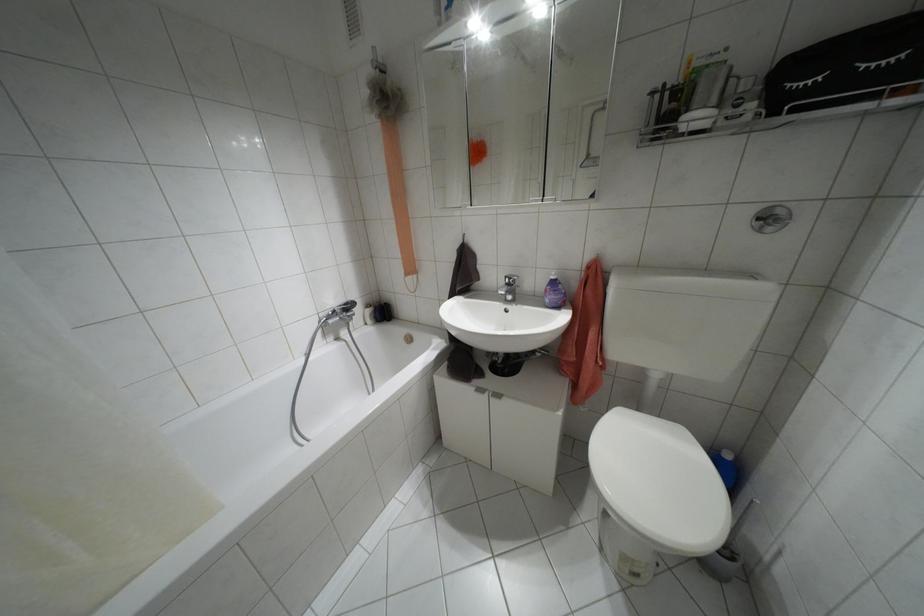
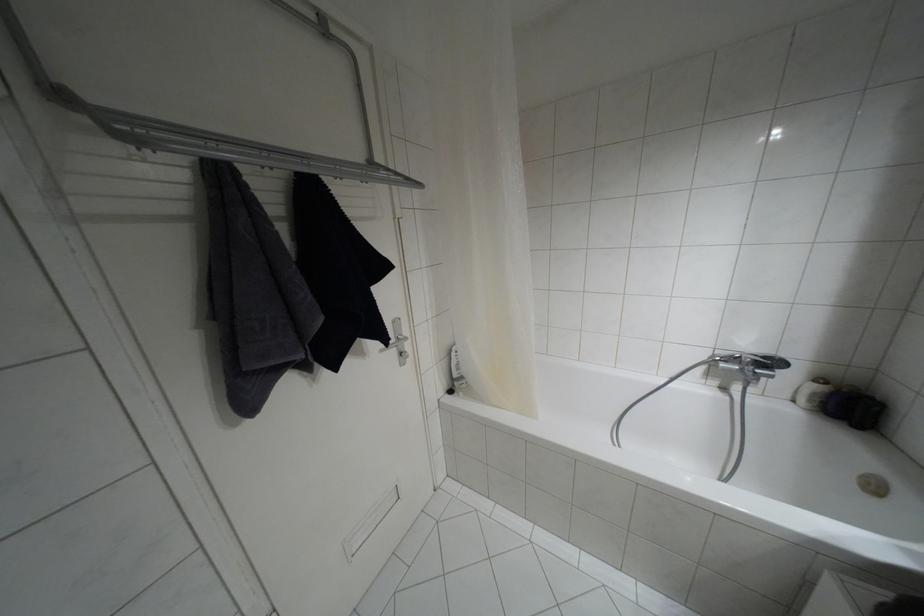
Find the pixel in the second image that matches point 367,305 in the first image.

(820, 379)